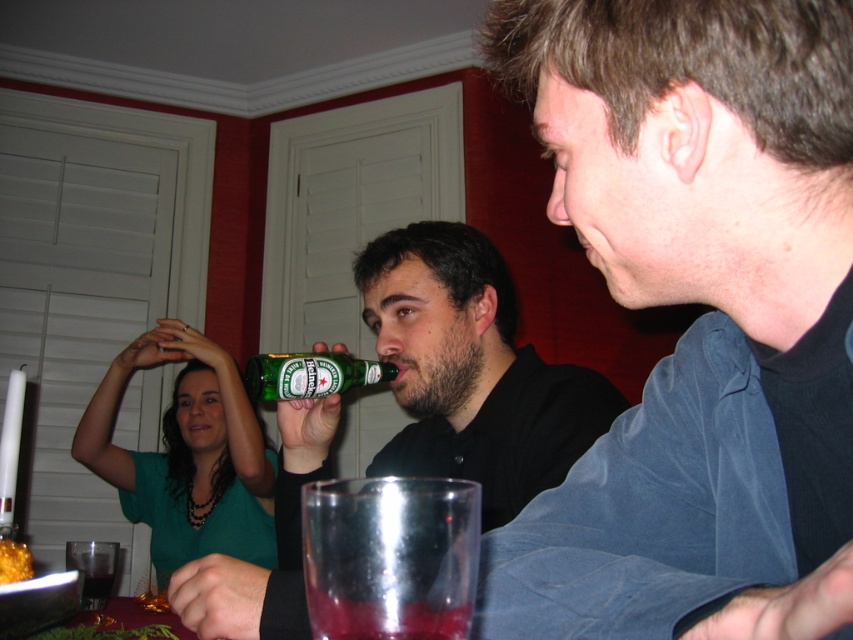
Does green matte beer bottle at center have a lesser width compared to transparent glass at lower center?

Incorrect, green matte beer bottle at center's width is not less than transparent glass at lower center's.

Between green matte beer bottle at center and transparent glass at lower center, which one appears on the right side from the viewer's perspective?

Positioned to the right is transparent glass at lower center.

Is point (403, 307) less distant than point (372, 506)?

No, it is behind (372, 506).

Image resolution: width=853 pixels, height=640 pixels. I want to click on green matte beer bottle at center, so click(x=473, y=371).

Can you confirm if golden crumbly pastry at lower left is positioned above clear plastic cup at lower left?

Indeed, golden crumbly pastry at lower left is positioned over clear plastic cup at lower left.

Is point (12, 561) positioned behind point (94, 573)?

No, (12, 561) is in front of (94, 573).

Measure the distance between golden crumbly pastry at lower left and camera.

They are 32.55 inches apart.

This screenshot has height=640, width=853. I want to click on golden crumbly pastry at lower left, so click(x=15, y=561).

Can you confirm if green matte shirt at upper left is positioned to the right of green glass bottle at center?

No, green matte shirt at upper left is not to the right of green glass bottle at center.

Does point (126, 513) lie behind point (311, 387)?

Yes, it is.

Where is `green matte shirt at upper left`? This screenshot has width=853, height=640. green matte shirt at upper left is located at coordinates (187, 454).